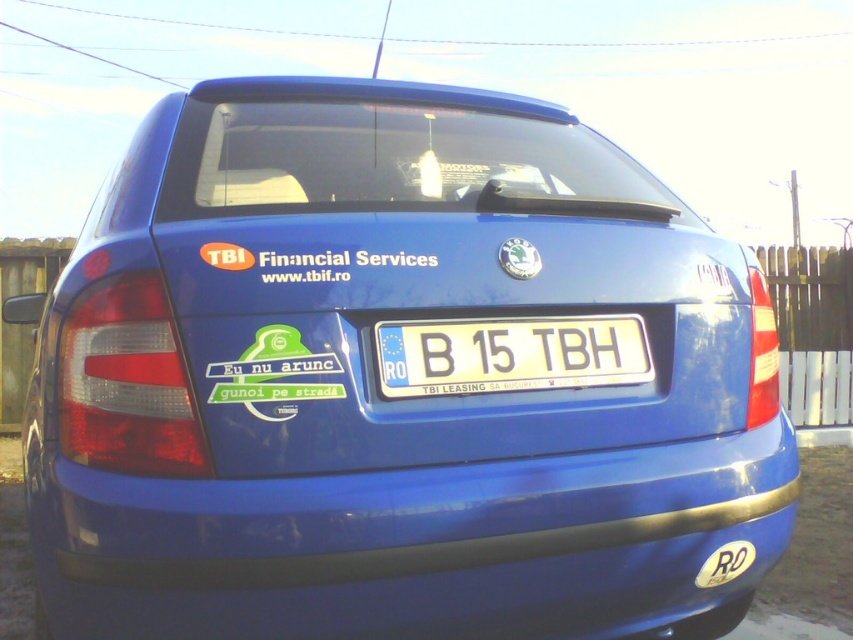
Is glossy plastic bumper at lower center wider than white plastic license plate at center?

Yes.

Is the position of glossy plastic bumper at lower center less distant than that of white plastic license plate at center?

Yes, glossy plastic bumper at lower center is in front of white plastic license plate at center.

Between point (260, 636) and point (524, 321), which one is positioned behind?

Positioned behind is point (524, 321).

Image resolution: width=853 pixels, height=640 pixels. I want to click on glossy plastic bumper at lower center, so coord(416,545).